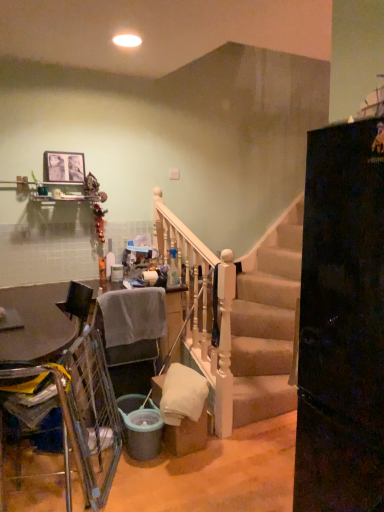
Question: From the image's perspective, is gray fabric chair at lower left, which ranks as the first armchair in back-to-front order, on metallic silver table at lower left?

Choices:
 (A) yes
 (B) no

Answer: (A)

Question: From a real-world perspective, is gray fabric chair at lower left, which ranks as the first armchair in back-to-front order, under metallic silver table at lower left?

Choices:
 (A) no
 (B) yes

Answer: (B)

Question: Considering the relative sizes of gray fabric chair at lower left, arranged as the 2th armchair when viewed from the front, and metallic silver table at lower left in the image provided, is gray fabric chair at lower left, arranged as the 2th armchair when viewed from the front, smaller than metallic silver table at lower left?

Choices:
 (A) yes
 (B) no

Answer: (A)

Question: Is metallic silver table at lower left located within gray fabric chair at lower left, which ranks as the first armchair in back-to-front order?

Choices:
 (A) yes
 (B) no

Answer: (B)

Question: Does gray fabric chair at lower left, which ranks as the first armchair in back-to-front order, come behind metallic silver table at lower left?

Choices:
 (A) yes
 (B) no

Answer: (A)

Question: Based on their positions, is gray fabric chair at lower left, which ranks as the first armchair in back-to-front order, located to the left or right of yellow fabric armchair at lower left, which ranks as the second armchair in back-to-front order?

Choices:
 (A) left
 (B) right

Answer: (B)

Question: Does point (125, 392) appear closer or farther from the camera than point (66, 487)?

Choices:
 (A) farther
 (B) closer

Answer: (A)

Question: From a real-world perspective, relative to yellow fabric armchair at lower left, which ranks as the second armchair in back-to-front order, is gray fabric chair at lower left, which ranks as the first armchair in back-to-front order, vertically above or below?

Choices:
 (A) above
 (B) below

Answer: (B)

Question: Considering their positions, is gray fabric chair at lower left, which ranks as the first armchair in back-to-front order, located in front of or behind yellow fabric armchair at lower left, which is the first armchair in front-to-back order?

Choices:
 (A) behind
 (B) front

Answer: (A)

Question: Looking at their shapes, would you say metallic silver table at lower left is wider or thinner than yellow fabric armchair at lower left, which is the first armchair in front-to-back order?

Choices:
 (A) thin
 (B) wide

Answer: (B)

Question: From the image's perspective, is metallic silver table at lower left above or below yellow fabric armchair at lower left, which ranks as the second armchair in back-to-front order?

Choices:
 (A) above
 (B) below

Answer: (B)

Question: Based on their positions, is metallic silver table at lower left located to the left or right of yellow fabric armchair at lower left, which is the first armchair in front-to-back order?

Choices:
 (A) right
 (B) left

Answer: (B)

Question: From a real-world perspective, is metallic silver table at lower left positioned above or below yellow fabric armchair at lower left, which is the first armchair in front-to-back order?

Choices:
 (A) above
 (B) below

Answer: (B)

Question: In terms of width, does yellow fabric armchair at lower left, which ranks as the second armchair in back-to-front order, look wider or thinner when compared to matte wooden picture frame at upper left?

Choices:
 (A) thin
 (B) wide

Answer: (B)

Question: From the image's perspective, is yellow fabric armchair at lower left, which ranks as the second armchair in back-to-front order, above or below matte wooden picture frame at upper left?

Choices:
 (A) below
 (B) above

Answer: (A)